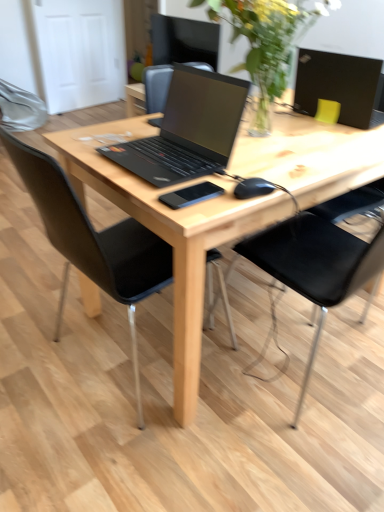
Question: Considering the relative positions of black leather chair at center, acting as the 2th chair starting from the left, and black leather chair at center, which is counted as the 2th chair, starting from the right, in the image provided, is black leather chair at center, acting as the 2th chair starting from the left, behind black leather chair at center, which is counted as the 2th chair, starting from the right,?

Choices:
 (A) no
 (B) yes

Answer: (B)

Question: Is black leather chair at center, which is counted as the 1th chair, starting from the right, at the right side of black leather chair at center, which ranks as the 1th chair in left-to-right order?

Choices:
 (A) yes
 (B) no

Answer: (A)

Question: Would you say black leather chair at center, acting as the 2th chair starting from the left, is outside black leather chair at center, which is counted as the 2th chair, starting from the right?

Choices:
 (A) yes
 (B) no

Answer: (A)

Question: Is black leather chair at center, acting as the 2th chair starting from the left, next to black leather chair at center, which is counted as the 2th chair, starting from the right?

Choices:
 (A) yes
 (B) no

Answer: (B)

Question: Considering the relative sizes of black leather chair at center, which is counted as the 1th chair, starting from the right, and black leather chair at center, which is counted as the 2th chair, starting from the right, in the image provided, is black leather chair at center, which is counted as the 1th chair, starting from the right, taller than black leather chair at center, which is counted as the 2th chair, starting from the right,?

Choices:
 (A) no
 (B) yes

Answer: (B)

Question: From the image's perspective, is black matte laptop at center, which is the second laptop in right-to-left order, positioned above or below black matte laptop at upper right, placed as the 2th laptop when sorted from left to right?

Choices:
 (A) above
 (B) below

Answer: (B)

Question: Is point (208, 144) closer or farther from the camera than point (354, 76)?

Choices:
 (A) closer
 (B) farther

Answer: (A)

Question: Is black matte laptop at center, which is the second laptop in right-to-left order, taller or shorter than black matte laptop at upper right, placed as the 2th laptop when sorted from left to right?

Choices:
 (A) short
 (B) tall

Answer: (A)

Question: Looking at the image, does black matte laptop at center, which is the second laptop in right-to-left order, seem bigger or smaller compared to black matte laptop at upper right, the second laptop from the front?

Choices:
 (A) big
 (B) small

Answer: (A)

Question: From a real-world perspective, relative to black matte laptop at center, placed as the 2th laptop when sorted from back to front, is natural wood desk at center vertically above or below?

Choices:
 (A) below
 (B) above

Answer: (A)

Question: Is point (107, 135) positioned closer to the camera than point (153, 182)?

Choices:
 (A) closer
 (B) farther

Answer: (B)

Question: Relative to black matte laptop at center, placed as the 2th laptop when sorted from back to front, is natural wood desk at center in front or behind?

Choices:
 (A) front
 (B) behind

Answer: (A)

Question: From the image's perspective, is natural wood desk at center positioned above or below black matte laptop at center, which is the 1th laptop from left to right?

Choices:
 (A) above
 (B) below

Answer: (B)

Question: From their relative heights in the image, would you say black matte mouse at center is taller or shorter than black matte laptop at upper right, placed as the 2th laptop when sorted from left to right?

Choices:
 (A) short
 (B) tall

Answer: (A)

Question: In the image, is black matte mouse at center on the left side or the right side of black matte laptop at upper right, arranged as the first laptop when viewed from the right?

Choices:
 (A) right
 (B) left

Answer: (B)